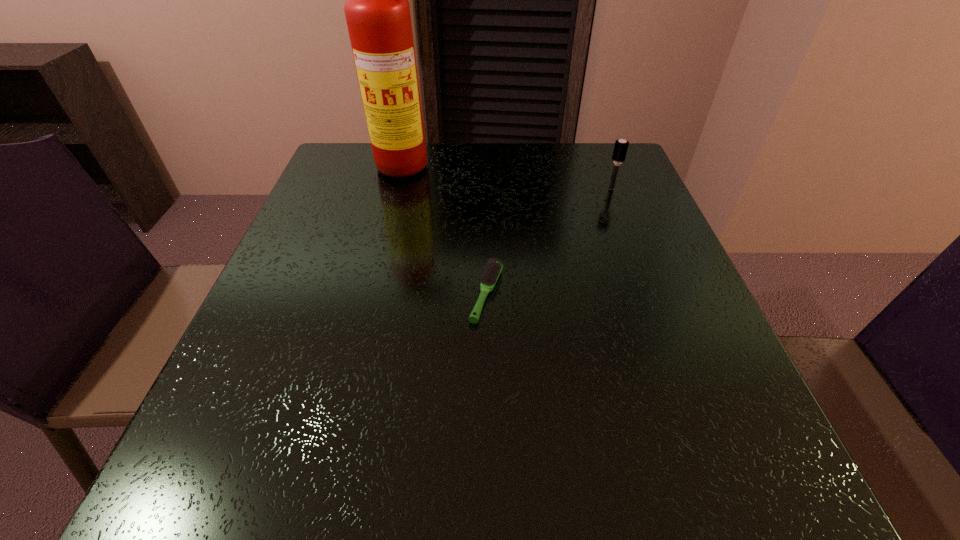
Where is `the leftmost object`? Image resolution: width=960 pixels, height=540 pixels. the leftmost object is located at coordinates (377, 11).

Identify the location of the tallest object. (377, 11).

Identify the location of the second nearest object. This screenshot has height=540, width=960. (620, 149).

Locate an element on the screen. This screenshot has height=540, width=960. the right hairbrush is located at coordinates (620, 149).

This screenshot has height=540, width=960. What are the coordinates of `the shortest object` in the screenshot? It's located at (493, 269).

At what (x,y) coordinates should I click in order to perform the action: click on the second object from right to left. Please return your answer as a coordinate pair (x, y). The image size is (960, 540). Looking at the image, I should click on pyautogui.click(x=493, y=269).

At what (x,y) coordinates should I click in order to perform the action: click on vacant region located on the front-facing side of the tallest object. Please return your answer as a coordinate pair (x, y). This screenshot has width=960, height=540. Looking at the image, I should click on (395, 240).

Identify the location of free spot located on the left of the second shortest object. (580, 188).

The image size is (960, 540). In order to click on vacant space located on the back of the second object from left to right in this screenshot , I will do `click(485, 192)`.

Image resolution: width=960 pixels, height=540 pixels. Find the location of `fire extinguisher located at the far edge`. fire extinguisher located at the far edge is located at coordinates (377, 11).